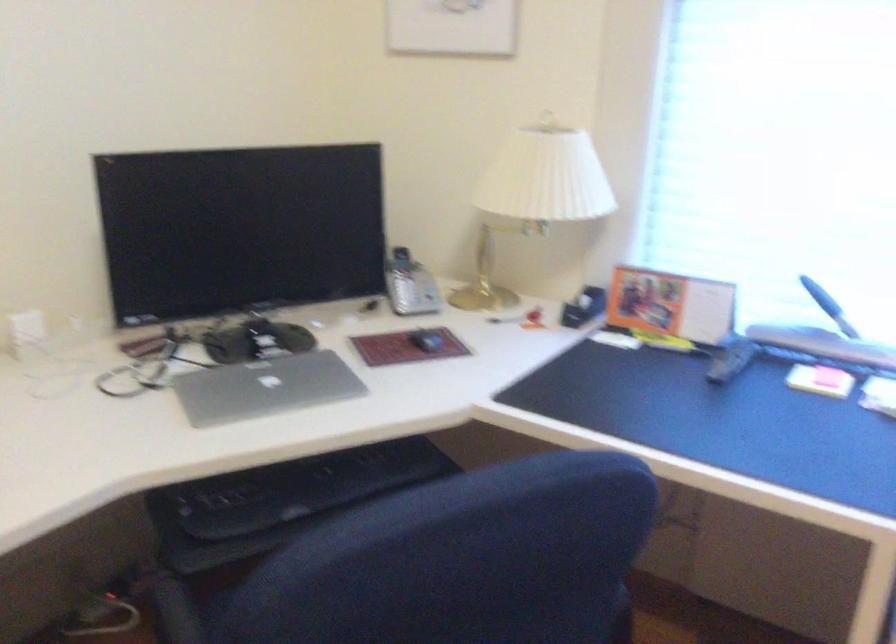
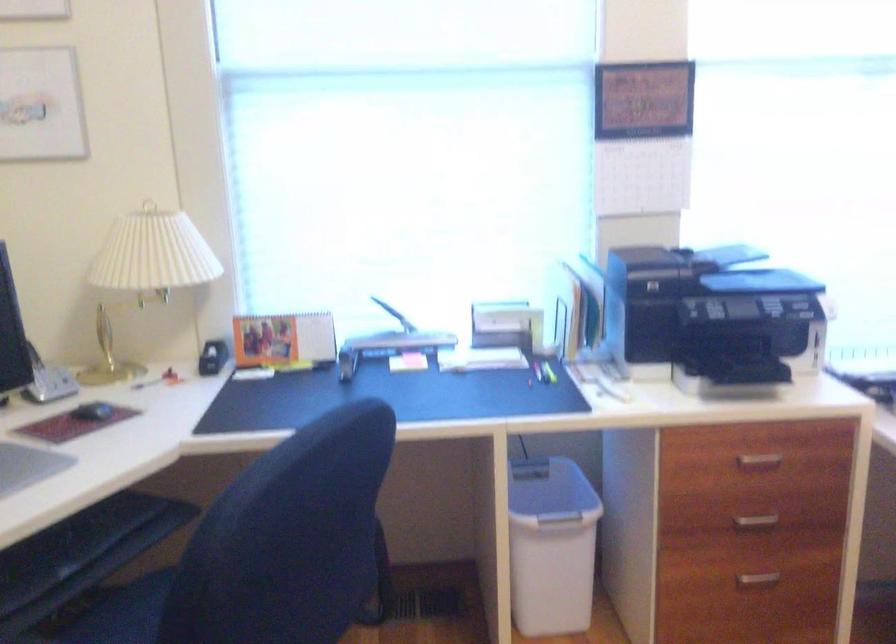
Question: The camera is either moving clockwise (left) or counter-clockwise (right) around the object. The first image is from the beginning of the video and the second image is from the end. Is the camera moving left or right when shooting the video?

Choices:
 (A) Left
 (B) Right

Answer: (A)